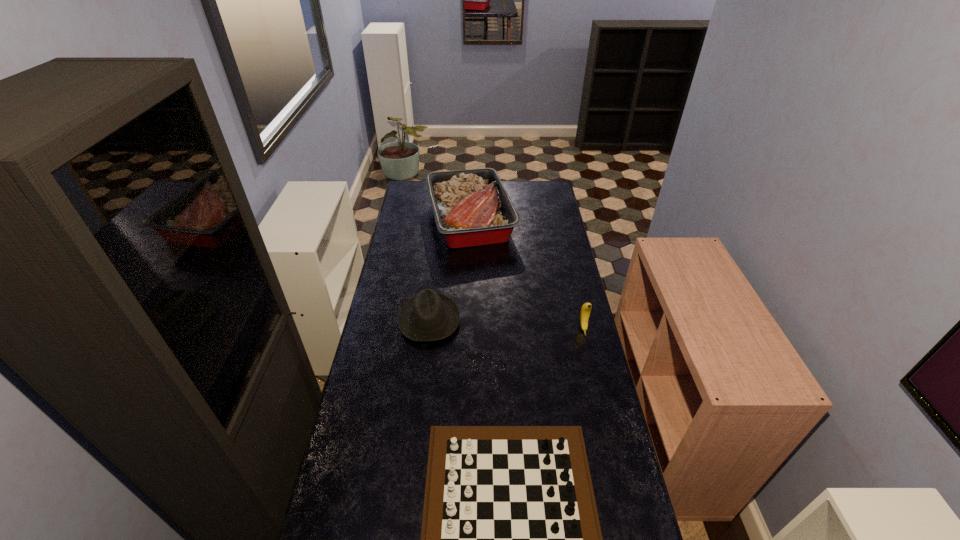
Where is `object that is at the far left corner`? object that is at the far left corner is located at coordinates (471, 207).

Image resolution: width=960 pixels, height=540 pixels. I want to click on blank space at the far edge of the desktop, so click(526, 201).

The image size is (960, 540). In the image, there is a desktop. What are the coordinates of `vacant space at the left edge` in the screenshot? It's located at (365, 465).

In the image, there is a desktop. At what (x,y) coordinates should I click in order to perform the action: click on vacant space at the right edge. Please return your answer as a coordinate pair (x, y). Image resolution: width=960 pixels, height=540 pixels. Looking at the image, I should click on (571, 261).

Image resolution: width=960 pixels, height=540 pixels. Find the location of `vacant area at the far left corner`. vacant area at the far left corner is located at coordinates (409, 188).

Identify the location of free space at the far right corner. Image resolution: width=960 pixels, height=540 pixels. (551, 198).

The width and height of the screenshot is (960, 540). What are the coordinates of `vacant space in between the tray and the fedora` in the screenshot? It's located at (450, 269).

What are the coordinates of `free area in between the tray and the third tallest object` in the screenshot? It's located at (450, 269).

Where is `free spot between the third tallest object and the farthest object`? This screenshot has width=960, height=540. free spot between the third tallest object and the farthest object is located at coordinates (450, 269).

Find the location of a particular element. This screenshot has height=540, width=960. the third closest object to the gameboard is located at coordinates (471, 207).